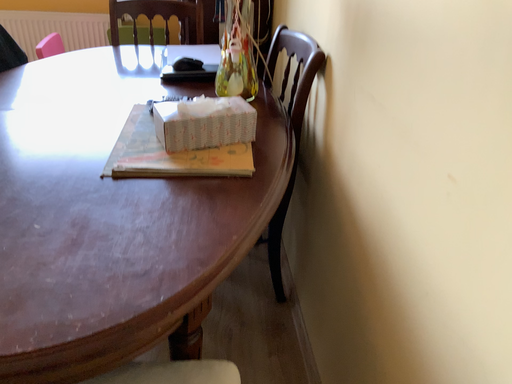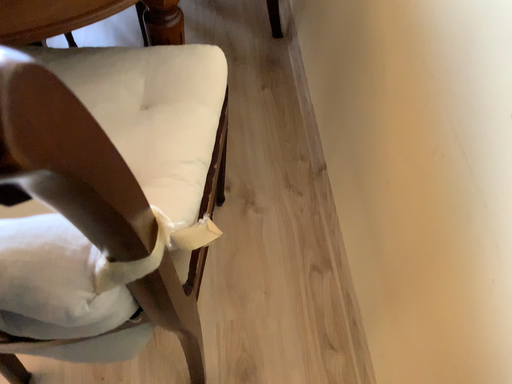
Question: Which way did the camera rotate in the video?

Choices:
 (A) rotated upward
 (B) rotated downward

Answer: (B)